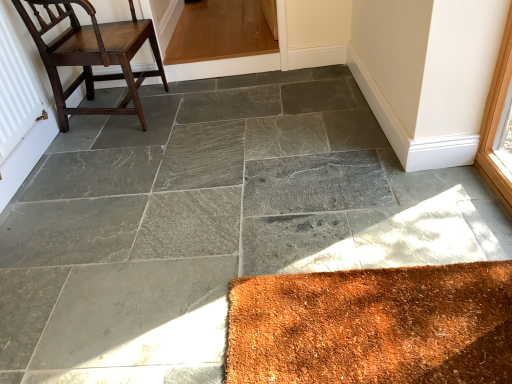
Question: Does point (34, 72) appear closer or farther from the camera than point (42, 18)?

Choices:
 (A) farther
 (B) closer

Answer: (A)

Question: From the image's perspective, is white textured radiator at left located above or below dark brown wood chair at left?

Choices:
 (A) below
 (B) above

Answer: (A)

Question: Relative to dark brown wood chair at left, is white textured radiator at left in front or behind?

Choices:
 (A) front
 (B) behind

Answer: (A)

Question: Considering the positions of dark brown wood chair at left and white textured radiator at left in the image, is dark brown wood chair at left bigger or smaller than white textured radiator at left?

Choices:
 (A) big
 (B) small

Answer: (A)

Question: From a real-world perspective, relative to white textured radiator at left, is dark brown wood chair at left vertically above or below?

Choices:
 (A) below
 (B) above

Answer: (A)

Question: Is dark brown wood chair at left in front of or behind white textured radiator at left in the image?

Choices:
 (A) front
 (B) behind

Answer: (B)

Question: Looking at their shapes, would you say dark brown wood chair at left is wider or thinner than white textured radiator at left?

Choices:
 (A) thin
 (B) wide

Answer: (B)